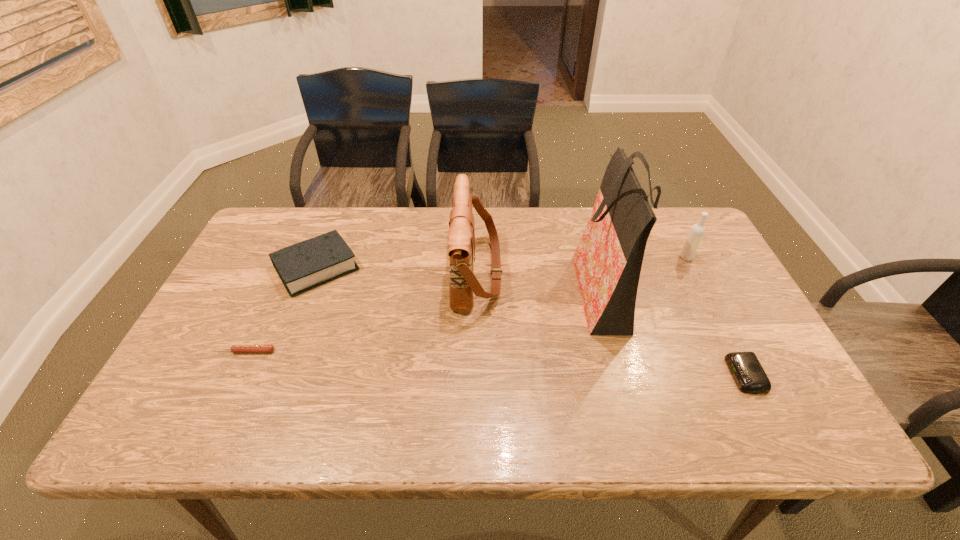
Identify the location of vacant area situated on the front side of the tallest object. The height and width of the screenshot is (540, 960). [x=533, y=288].

Locate an element on the screen. vacant region located on the front side of the tallest object is located at coordinates (459, 288).

The width and height of the screenshot is (960, 540). I want to click on free space located 0.090m on the front side of the tallest object, so click(x=540, y=288).

You are a GUI agent. You are given a task and a screenshot of the screen. Output one action in this format:
    pyautogui.click(x=<x>, y=<y>)
    Task: Click on the vacant space situated 0.050m on the front-facing side of the fifth shortest object
    The image size is (960, 540).
    Given the screenshot: What is the action you would take?
    pos(519,272)

At what (x,y) coordinates should I click in order to perform the action: click on vacant space positioned on the left of the vodka. Please return your answer as a coordinate pair (x, y). This screenshot has height=540, width=960. Looking at the image, I should click on (594, 258).

The width and height of the screenshot is (960, 540). Identify the location of free space located 0.110m on the right of the fourth tallest object. (398, 268).

At what (x,y) coordinates should I click in order to perform the action: click on vacant space located on the display of the second shortest object. Please return your answer as a coordinate pair (x, y). The image size is (960, 540). Looking at the image, I should click on (709, 375).

Where is `free space located 0.100m on the display of the second shortest object`? The height and width of the screenshot is (540, 960). free space located 0.100m on the display of the second shortest object is located at coordinates (688, 375).

At what (x,y) coordinates should I click in order to perform the action: click on vacant region located on the display of the second shortest object. Please return your answer as a coordinate pair (x, y). The image size is (960, 540). Looking at the image, I should click on (573, 375).

This screenshot has width=960, height=540. In order to click on vacant area located on the back of the shortest object in this screenshot , I will do `click(267, 301)`.